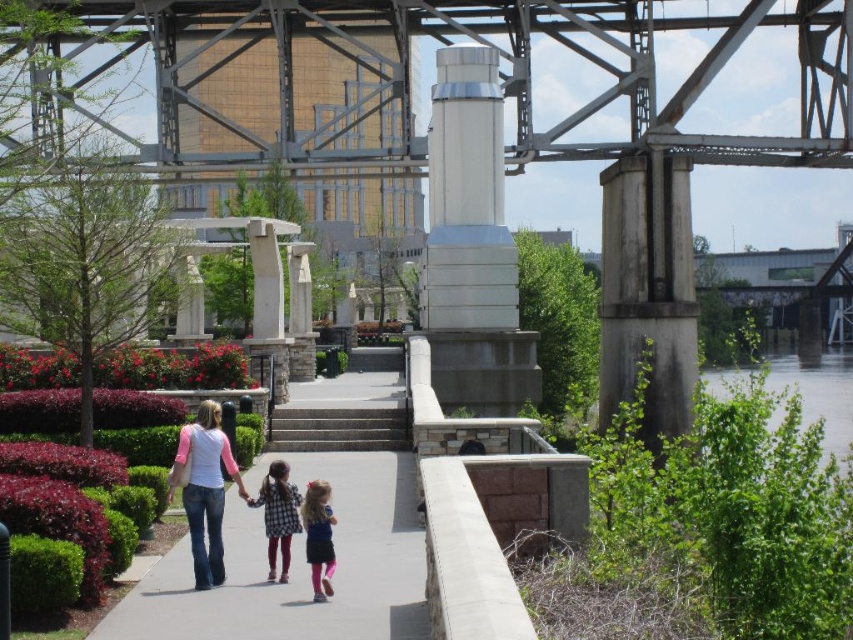
Does pink jersey at left appear on the left side of gray concrete stairs at center?

Yes, pink jersey at left is to the left of gray concrete stairs at center.

Does pink jersey at left have a larger size compared to gray concrete stairs at center?

Indeed, pink jersey at left has a larger size compared to gray concrete stairs at center.

Which is in front, point (221, 509) or point (339, 442)?

Positioned in front is point (221, 509).

At what (x,y) coordinates should I click in order to perform the action: click on pink jersey at left. Please return your answer as a coordinate pair (x, y). Looking at the image, I should click on (204, 488).

Is point (405, 157) behind point (279, 520)?

Yes, it is behind point (279, 520).

Does metallic gray bridge at center appear on the left side of plaid fabric shirt at center?

No, metallic gray bridge at center is not to the left of plaid fabric shirt at center.

Is point (692, 358) in front of point (280, 506)?

That is False.

Locate an element on the screen. metallic gray bridge at center is located at coordinates (514, 122).

This screenshot has width=853, height=640. What do you see at coordinates (297, 564) in the screenshot? I see `gray concrete pavement at center` at bounding box center [297, 564].

Who is shorter, gray concrete pavement at center or plaid fabric shirt at center?

plaid fabric shirt at center

Does point (300, 595) lie behind point (277, 483)?

No.

Identify the location of gray concrete pavement at center. (297, 564).